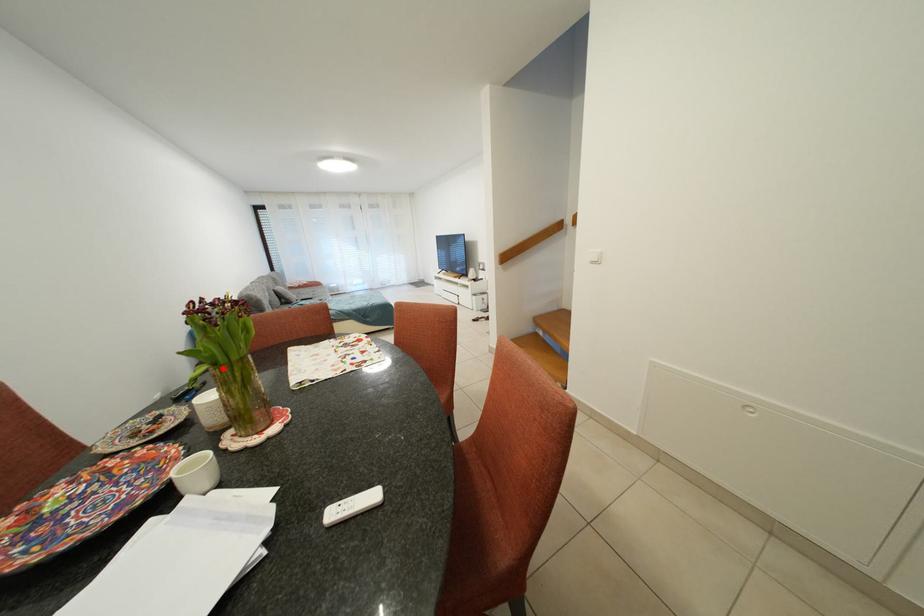
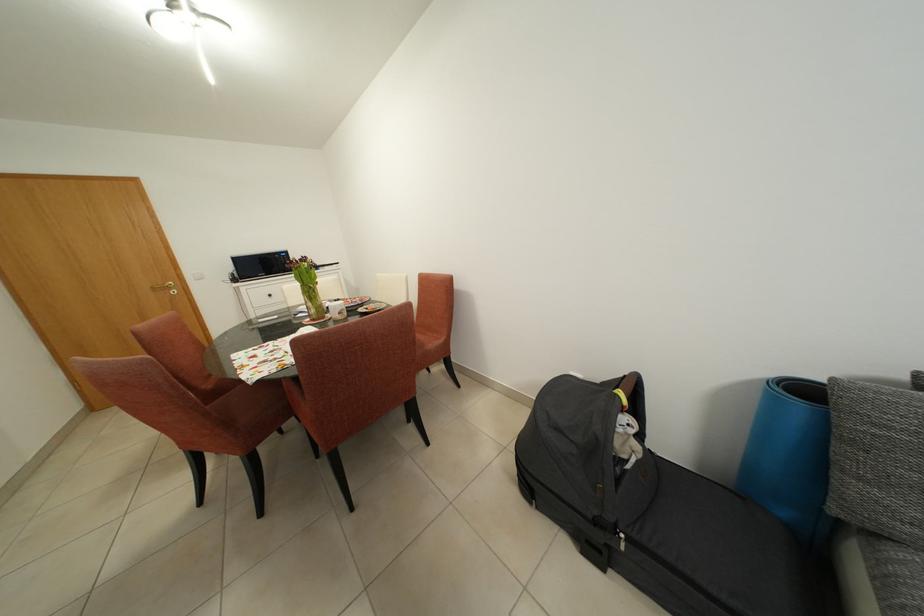
The point at the highlighted location is marked in the first image. Where is the corresponding point in the second image?

(319, 286)